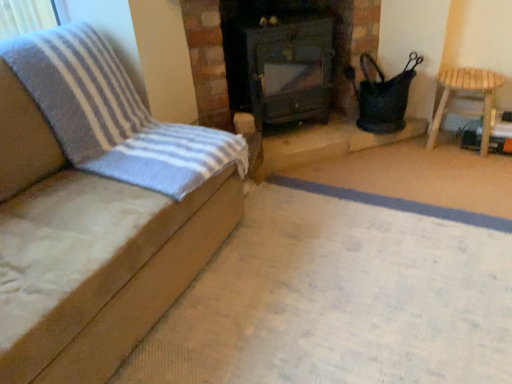
Question: From the image's perspective, is dark green wood stove at center on suede-like beige sofa at left, the 2th furniture when ordered from back to front?

Choices:
 (A) yes
 (B) no

Answer: (A)

Question: Does dark green wood stove at center appear on the left side of suede-like beige sofa at left, the 2th furniture when ordered from back to front?

Choices:
 (A) yes
 (B) no

Answer: (B)

Question: Can you confirm if dark green wood stove at center is wider than suede-like beige sofa at left, the second furniture when ordered from right to left?

Choices:
 (A) yes
 (B) no

Answer: (B)

Question: Is dark green wood stove at center thinner than suede-like beige sofa at left, which ranks as the 1th furniture in front-to-back order?

Choices:
 (A) yes
 (B) no

Answer: (A)

Question: Is dark green wood stove at center smaller than suede-like beige sofa at left, the second furniture when ordered from right to left?

Choices:
 (A) no
 (B) yes

Answer: (B)

Question: Can suede-like beige sofa at left, which appears as the first furniture when viewed from the left, be found inside dark green wood stove at center?

Choices:
 (A) yes
 (B) no

Answer: (B)

Question: Does light brown wooden stool at right, which ranks as the 1th furniture in back-to-front order, have a greater width compared to suede-like beige sofa at left, which appears as the first furniture when viewed from the left?

Choices:
 (A) no
 (B) yes

Answer: (A)

Question: From the image's perspective, is light brown wooden stool at right, which ranks as the 1th furniture in back-to-front order, below suede-like beige sofa at left, the second furniture when ordered from right to left?

Choices:
 (A) yes
 (B) no

Answer: (B)

Question: Does light brown wooden stool at right, which ranks as the first furniture in right-to-left order, come in front of suede-like beige sofa at left, the 2th furniture when ordered from back to front?

Choices:
 (A) no
 (B) yes

Answer: (A)

Question: Is light brown wooden stool at right, which ranks as the first furniture in right-to-left order, aimed at suede-like beige sofa at left, which ranks as the 1th furniture in front-to-back order?

Choices:
 (A) yes
 (B) no

Answer: (B)

Question: Is light brown wooden stool at right, which ranks as the 1th furniture in back-to-front order, taller than suede-like beige sofa at left, the second furniture when ordered from right to left?

Choices:
 (A) no
 (B) yes

Answer: (A)

Question: Is light brown wooden stool at right, which ranks as the first furniture in right-to-left order, further to the viewer compared to suede-like beige sofa at left, which appears as the first furniture when viewed from the left?

Choices:
 (A) yes
 (B) no

Answer: (A)

Question: Can you confirm if dark green wood stove at center is wider than light brown wooden stool at right, which ranks as the first furniture in right-to-left order?

Choices:
 (A) yes
 (B) no

Answer: (A)